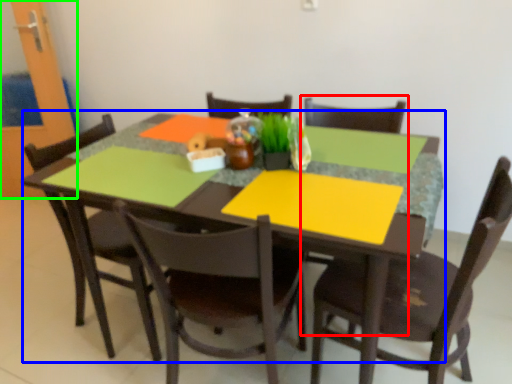
Question: Considering the real-world distances, which object is closest to armchair (highlighted by a red box)? kitchen & dining room table (highlighted by a blue box) or glass door (highlighted by a green box).

Choices:
 (A) kitchen & dining room table
 (B) glass door

Answer: (A)